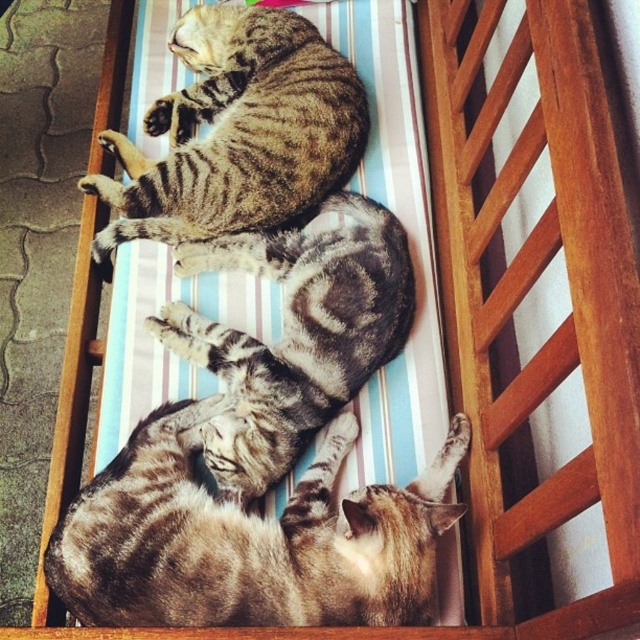
Can you confirm if tabby fur cat at upper center is wider than tabby fur cat at center?

Indeed, tabby fur cat at upper center has a greater width compared to tabby fur cat at center.

Which is behind, point (232, 198) or point (195, 252)?

Point (232, 198)

Which is in front, point (266, 184) or point (296, 400)?

Point (296, 400) is more forward.

Where is `tabby fur cat at upper center`? The image size is (640, 640). tabby fur cat at upper center is located at coordinates coord(237,131).

Is golden tabby cat at lower left positioned behind tabby fur cat at upper center?

No, golden tabby cat at lower left is closer to the viewer.

You are a GUI agent. You are given a task and a screenshot of the screen. Output one action in this format:
    pyautogui.click(x=<x>, y=<y>)
    Task: Click on the golden tabby cat at lower left
    The width and height of the screenshot is (640, 640).
    Given the screenshot: What is the action you would take?
    pyautogui.click(x=248, y=538)

This screenshot has width=640, height=640. What are the coordinates of `golden tabby cat at lower left` in the screenshot? It's located at (248, 538).

Which is behind, point (387, 541) or point (278, 237)?

The point (278, 237) is more distant.

Between point (292, 586) and point (289, 372), which one is positioned in front?

Point (292, 586) is in front.

Between point (204, 536) and point (250, 260), which one is positioned behind?

The point (250, 260) is behind.

Find the location of a particular element. golden tabby cat at lower left is located at coordinates (248, 538).